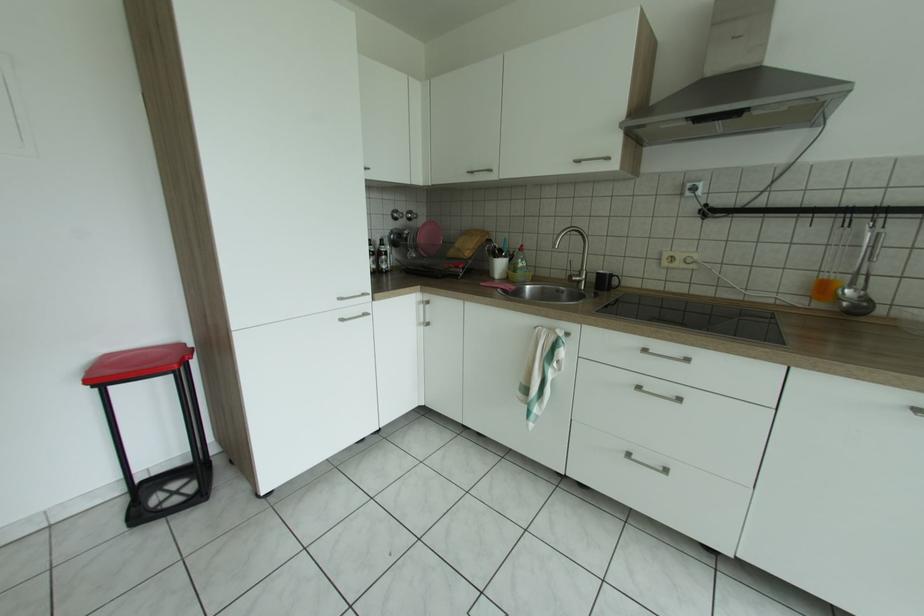
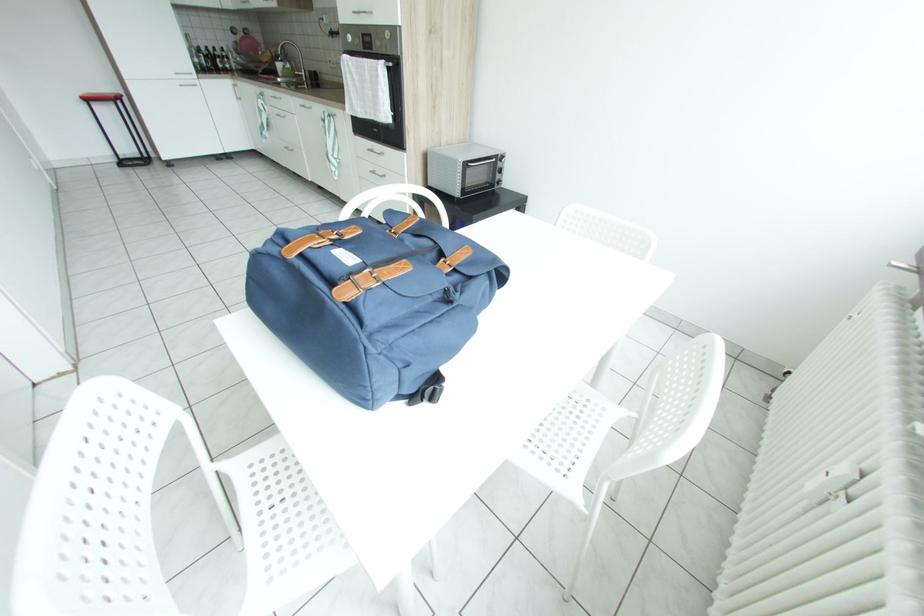
What movement of the cameraman would produce the second image?

The cameraman moved toward right, backward.